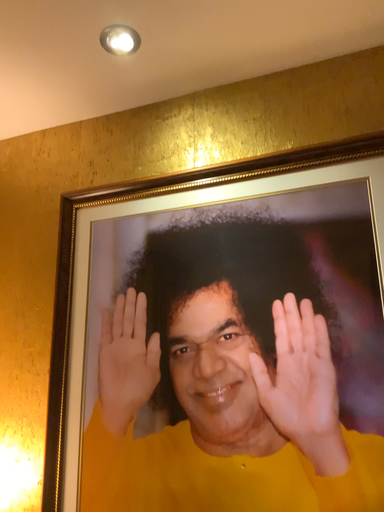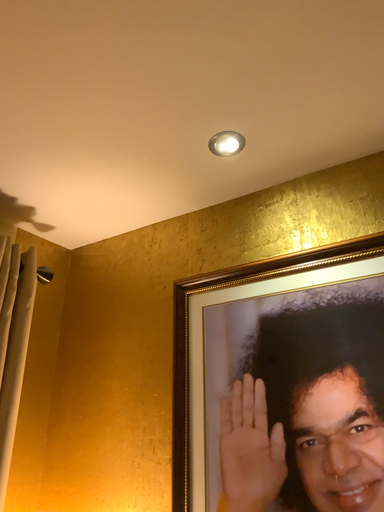
Question: How did the camera likely rotate when shooting the video?

Choices:
 (A) rotated upward
 (B) rotated downward

Answer: (A)